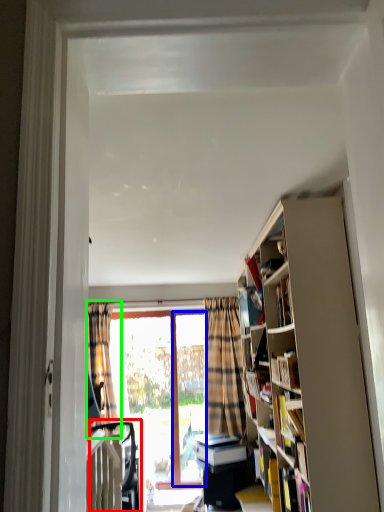
Question: Considering the real-world distances, which object is closest to swivel chair (highlighted by a red box)? screen door (highlighted by a blue box) or curtain (highlighted by a green box).

Choices:
 (A) screen door
 (B) curtain

Answer: (B)